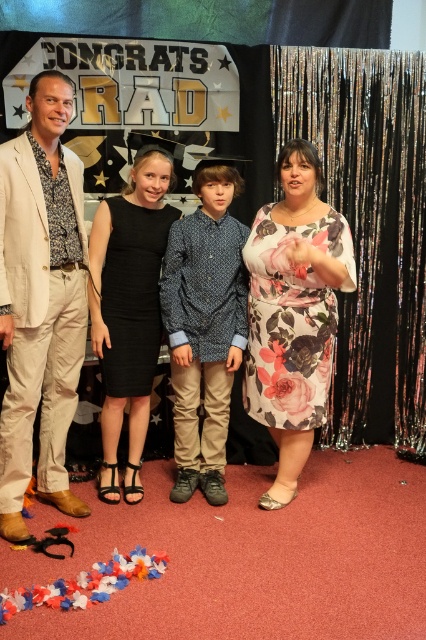
You are standing in the graduation photo and want to take a closer look at the point marked at coordinates [9,148]. If you move forward 1 meter, will you be within 1.5 meters of that point?

The point at [9,148] is 2.43 meters away from the viewer. Moving forward 1 meter would bring you to 1.43 meters away from the point, which is within the 1.5 meters range.

You are a photographer at the graduation event. You need to ensure that both the beige cotton blazer at left and the floral fabric dress at center are clearly visible in the photo. Given their sizes, which one might require you to adjust your camera angle to capture more detail?

The beige cotton blazer at left is smaller than the floral fabric dress at center, so you might need to adjust the camera angle to focus more on the smaller beige cotton blazer at left to ensure it is clearly visible.